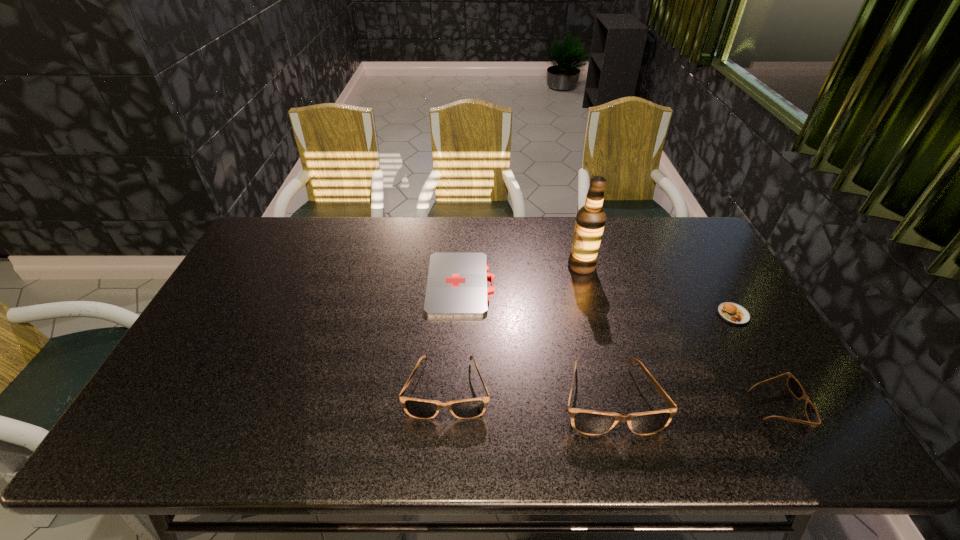
At what (x,y) coordinates should I click in order to perform the action: click on free space between the shortest sunglasses and the leftmost sunglasses. Please return your answer as a coordinate pair (x, y). This screenshot has width=960, height=540. Looking at the image, I should click on (612, 398).

Locate an element on the screen. This screenshot has width=960, height=540. free spot between the first-aid kit and the second shortest sunglasses is located at coordinates (454, 336).

In order to click on object identified as the fourth closest to the patty in this screenshot , I will do `click(456, 286)`.

Identify the location of object that is the fifth nearest to the tallest object. The width and height of the screenshot is (960, 540). (794, 386).

Find the location of a particular element. The width and height of the screenshot is (960, 540). sunglasses that is the closest to the second sunglasses from left to right is located at coordinates coord(472,408).

Where is `sunglasses that can be found as the second closest to the second sunglasses from left to right`? This screenshot has width=960, height=540. sunglasses that can be found as the second closest to the second sunglasses from left to right is located at coordinates (794, 386).

This screenshot has height=540, width=960. I want to click on vacant space that satisfies the following two spatial constraints: 1. on the label of the tallest object; 2. on the frames of the second tallest sunglasses, so click(613, 389).

Find the location of a particular element. vacant space that satisfies the following two spatial constraints: 1. on handle side the shortest object; 2. on the frames of the third tallest object is located at coordinates (456, 389).

Where is `vacant space that satisfies the following two spatial constraints: 1. on the front side of the patty; 2. on the frames of the rightmost sunglasses`? vacant space that satisfies the following two spatial constraints: 1. on the front side of the patty; 2. on the frames of the rightmost sunglasses is located at coordinates (787, 407).

The height and width of the screenshot is (540, 960). I want to click on free space that satisfies the following two spatial constraints: 1. on the label of the tallest object; 2. on the frames of the second sunglasses from left to right, so click(x=616, y=397).